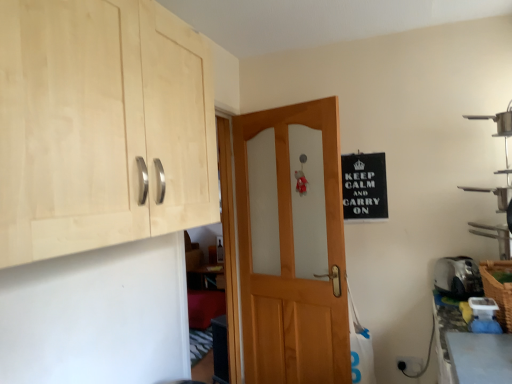
Question: From a real-world perspective, is black plastic electric outlet at lower right below natural wood cabinet at upper left?

Choices:
 (A) no
 (B) yes

Answer: (B)

Question: Is black plastic electric outlet at lower right further to the viewer compared to natural wood cabinet at upper left?

Choices:
 (A) yes
 (B) no

Answer: (A)

Question: From the image's perspective, is black plastic electric outlet at lower right on natural wood cabinet at upper left?

Choices:
 (A) no
 (B) yes

Answer: (A)

Question: Considering the relative sizes of black plastic electric outlet at lower right and natural wood cabinet at upper left in the image provided, is black plastic electric outlet at lower right taller than natural wood cabinet at upper left?

Choices:
 (A) no
 (B) yes

Answer: (A)

Question: Is black plastic electric outlet at lower right not within natural wood cabinet at upper left?

Choices:
 (A) no
 (B) yes

Answer: (B)

Question: Is black plastic electric outlet at lower right turned away from natural wood cabinet at upper left?

Choices:
 (A) no
 (B) yes

Answer: (A)

Question: Is silver metallic toaster at lower right at the back of woven brown basket at lower right?

Choices:
 (A) no
 (B) yes

Answer: (A)

Question: Is woven brown basket at lower right to the left of silver metallic toaster at lower right from the viewer's perspective?

Choices:
 (A) yes
 (B) no

Answer: (A)

Question: Does woven brown basket at lower right have a larger size compared to silver metallic toaster at lower right?

Choices:
 (A) no
 (B) yes

Answer: (B)

Question: Is the position of woven brown basket at lower right more distant than that of silver metallic toaster at lower right?

Choices:
 (A) yes
 (B) no

Answer: (B)

Question: Is woven brown basket at lower right aimed at silver metallic toaster at lower right?

Choices:
 (A) yes
 (B) no

Answer: (B)

Question: Considering the relative sizes of woven brown basket at lower right and silver metallic toaster at lower right in the image provided, is woven brown basket at lower right thinner than silver metallic toaster at lower right?

Choices:
 (A) yes
 (B) no

Answer: (A)

Question: Is black paper sign at upper right at the left side of natural wood cabinet at upper left?

Choices:
 (A) yes
 (B) no

Answer: (B)